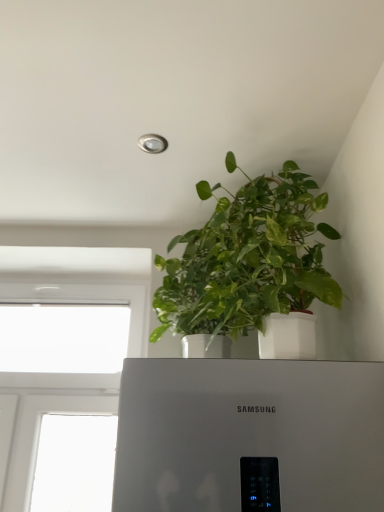
This screenshot has width=384, height=512. Identify the location of vacant space situated above green matte plant at upper center (from a real-world perspective). (224, 166).